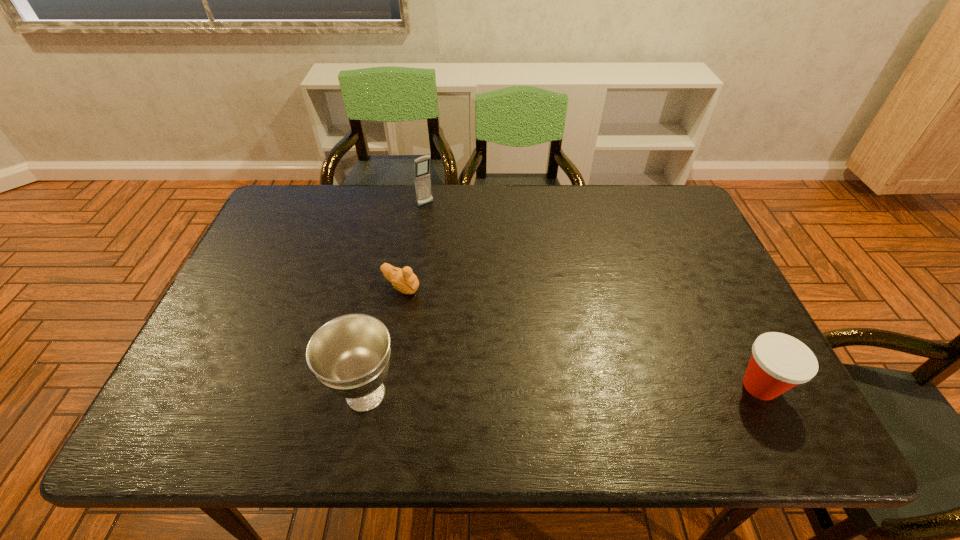
This screenshot has width=960, height=540. What are the coordinates of `blank area located 0.380m on the face of the shortest object` in the screenshot? It's located at (543, 364).

Locate an element on the screen. Image resolution: width=960 pixels, height=540 pixels. free spot located on the front-facing side of the farthest object is located at coordinates (451, 232).

Locate an element on the screen. The width and height of the screenshot is (960, 540). free region located on the front-facing side of the farthest object is located at coordinates pos(468,251).

Locate an element on the screen. This screenshot has height=540, width=960. vacant space positioned on the front-facing side of the farthest object is located at coordinates (490, 275).

Image resolution: width=960 pixels, height=540 pixels. I want to click on object present at the far edge, so click(x=422, y=181).

You are a GUI agent. You are given a task and a screenshot of the screen. Output one action in this format:
    pyautogui.click(x=<x>, y=<y>)
    Task: Click on the chalice at the near edge
    
    Given the screenshot: What is the action you would take?
    pyautogui.click(x=350, y=355)

Where is `Dixie cup located at the near edge`? The height and width of the screenshot is (540, 960). Dixie cup located at the near edge is located at coordinates (779, 362).

This screenshot has height=540, width=960. Find the location of `object at the right edge`. object at the right edge is located at coordinates (779, 362).

Where is `object at the near right corner`? The width and height of the screenshot is (960, 540). object at the near right corner is located at coordinates (779, 362).

In the image, there is a desktop. Where is `vacant space at the far edge`? This screenshot has height=540, width=960. vacant space at the far edge is located at coordinates (599, 215).